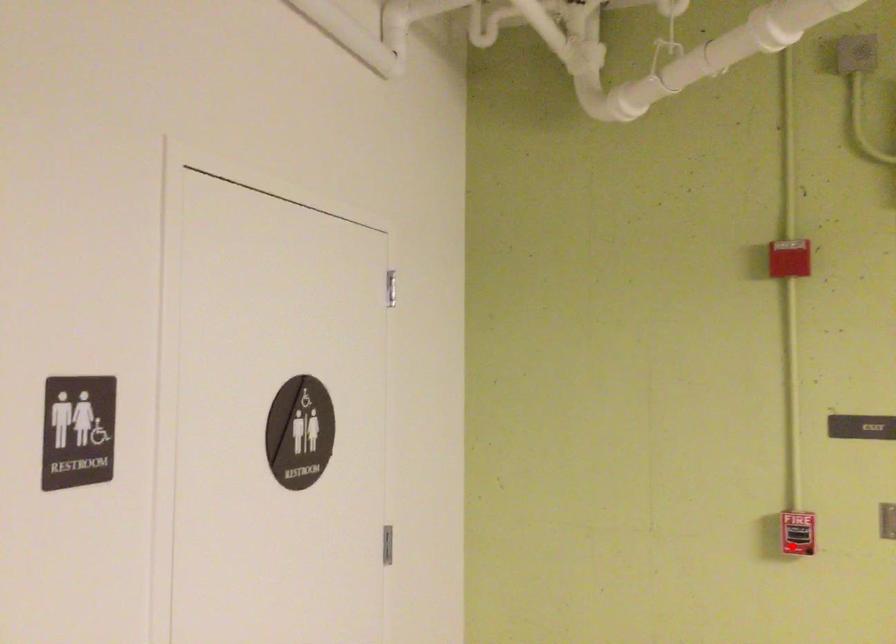
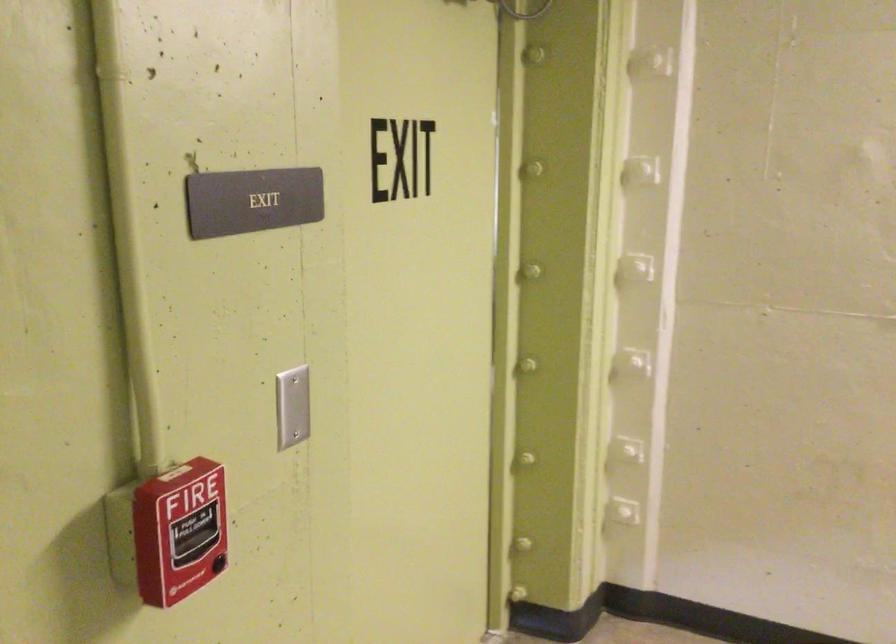
In the second image, find the point that corresponds to the highlighted location in the first image.

(179, 532)